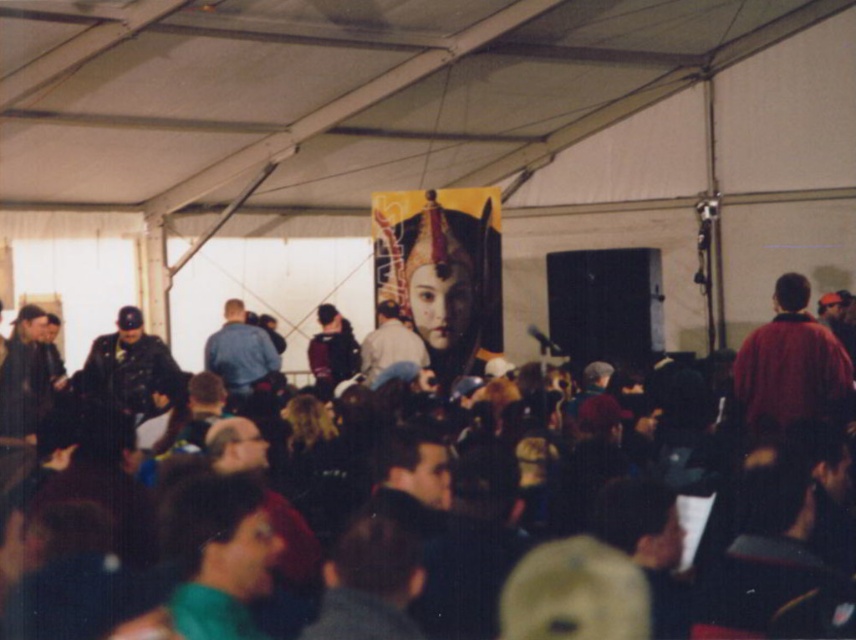
Question: Does dark brown hair at center appear over blue denim jacket at center?

Choices:
 (A) no
 (B) yes

Answer: (A)

Question: Which of the following is the farthest from the observer?

Choices:
 (A) blue denim jacket at center
 (B) red matte jacket at right
 (C) dark brown hair at center

Answer: (A)

Question: Which point is farther from the camera taking this photo?

Choices:
 (A) (242, 323)
 (B) (465, 545)
 (C) (840, 348)

Answer: (A)

Question: Can you confirm if dark brown hair at center is thinner than red matte jacket at right?

Choices:
 (A) yes
 (B) no

Answer: (B)

Question: Which of the following is the farthest from the observer?

Choices:
 (A) dark brown hair at center
 (B) red matte jacket at right

Answer: (B)

Question: Is red matte jacket at right positioned in front of blue denim jacket at center?

Choices:
 (A) yes
 (B) no

Answer: (A)